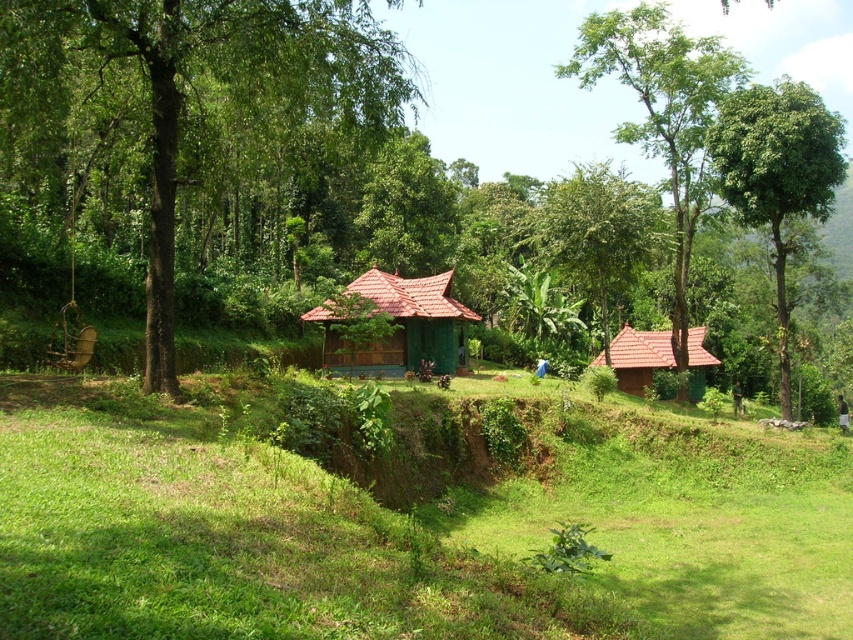
Based on the photo, you are planning to plant a new tree in this rural landscape. The green leafy forest at center and the green leafy tree at upper center are already present. Which of these two has a larger size, and why?

The green leafy tree at upper center is larger than the green leafy forest at center because the description states that the forest is smaller in size compared to the tree.

You are standing in the rural landscape and want to place a small garden ornament between the two points labeled point [421,531] and point [233,161]. Which point should the ornament be closer to if you want it to appear larger in the foreground?

The ornament should be placed closer to point [421,531] because it is closer to the camera, making objects placed there appear larger in the foreground compared to point [233,161] which is farther away.

In the scene shown: You are standing at the center of the grassy area and want to walk towards the green leafy tree at left. Which direction should you head?

The green leafy tree at left is located at point 0.178 on the x and y axis, so you should head towards the left direction to reach it.